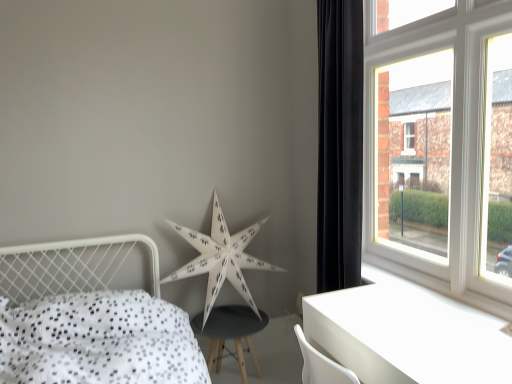
Question: Is black velvet curtain at right facing towards white glossy table at lower right?

Choices:
 (A) no
 (B) yes

Answer: (A)

Question: From a real-world perspective, is black velvet curtain at right located higher than white glossy table at lower right?

Choices:
 (A) yes
 (B) no

Answer: (A)

Question: From a real-world perspective, is black velvet curtain at right located beneath white glossy table at lower right?

Choices:
 (A) yes
 (B) no

Answer: (B)

Question: Considering the relative sizes of black velvet curtain at right and white glossy table at lower right in the image provided, is black velvet curtain at right smaller than white glossy table at lower right?

Choices:
 (A) yes
 (B) no

Answer: (A)

Question: Is black velvet curtain at right turned away from white glossy table at lower right?

Choices:
 (A) yes
 (B) no

Answer: (B)

Question: Is white wooden window at upper right situated inside black velvet curtain at right or outside?

Choices:
 (A) inside
 (B) outside

Answer: (B)

Question: From a real-world perspective, relative to black velvet curtain at right, is white wooden window at upper right vertically above or below?

Choices:
 (A) below
 (B) above

Answer: (B)

Question: Looking at the image, does white wooden window at upper right seem bigger or smaller compared to black velvet curtain at right?

Choices:
 (A) small
 (B) big

Answer: (B)

Question: Is white wooden window at upper right taller or shorter than black velvet curtain at right?

Choices:
 (A) tall
 (B) short

Answer: (B)

Question: Considering the relative positions of white paper star at center and white wooden window at upper right in the image provided, is white paper star at center to the left or to the right of white wooden window at upper right?

Choices:
 (A) left
 (B) right

Answer: (A)

Question: From their relative heights in the image, would you say white paper star at center is taller or shorter than white wooden window at upper right?

Choices:
 (A) tall
 (B) short

Answer: (B)

Question: From a real-world perspective, relative to white wooden window at upper right, is white paper star at center vertically above or below?

Choices:
 (A) below
 (B) above

Answer: (A)

Question: From the image's perspective, is white paper star at center positioned above or below white wooden window at upper right?

Choices:
 (A) below
 (B) above

Answer: (A)

Question: Is point (90, 240) closer or farther from the camera than point (320, 312)?

Choices:
 (A) farther
 (B) closer

Answer: (A)

Question: In the image, is white dotted fabric bed at lower left positioned in front of or behind white glossy table at lower right?

Choices:
 (A) behind
 (B) front

Answer: (B)